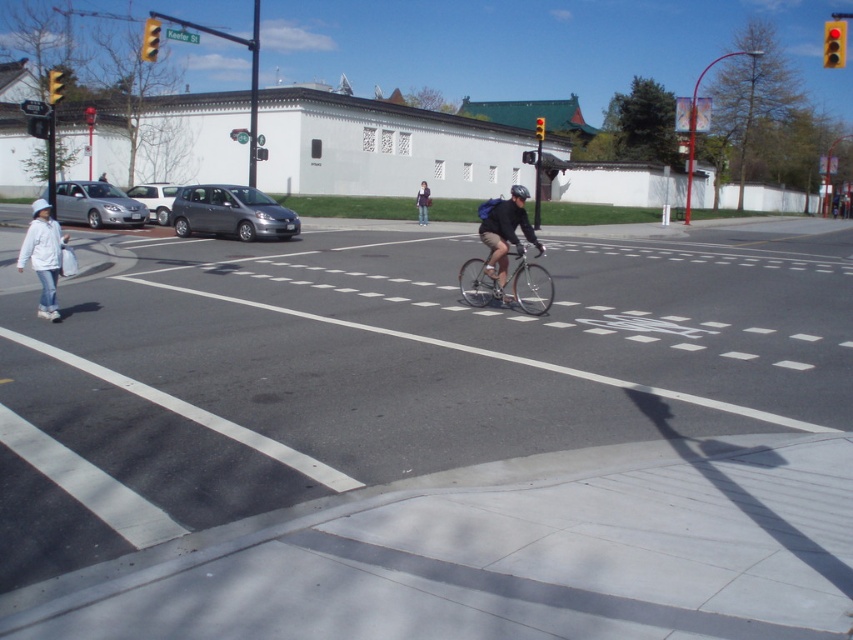
You are a delivery person who needs to load a large box into the back of the satin gray car at center. The box is as wide as the white matte jacket at lower left. Will the box fit in the car?

The satin gray car at center is narrower than the white matte jacket at lower left, so the box, which is as wide as the white matte jacket at lower left, will not fit in the satin gray car at center.

You are a delivery driver who needs to park your satin gray car at center in the parking lot near the white building with a green roof. According to the map coordinates, the parking lot is located at point 0.333, 0.271. Is your car already parked in the correct spot?

Yes, the satin gray car at center is already parked in the correct spot because its position matches the coordinates of the parking lot at point (230,212).

You are a delivery person needing to place a large package in the area shown. The package is too big to fit in the trunk of the satin gray car at center. Where else can you place it near the white matte jacket at lower left?

The white matte jacket at lower left is smaller than the satin gray car at center, so the package might not fit there either. Consider looking for a larger space nearby.